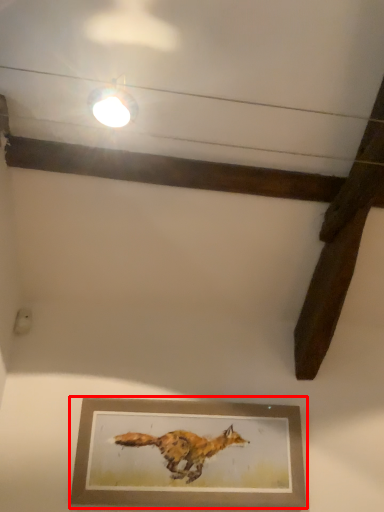
Question: Observing the image, what is the correct spatial positioning of picture frame (annotated by the red box) in reference to light fixture?

Choices:
 (A) right
 (B) left

Answer: (A)